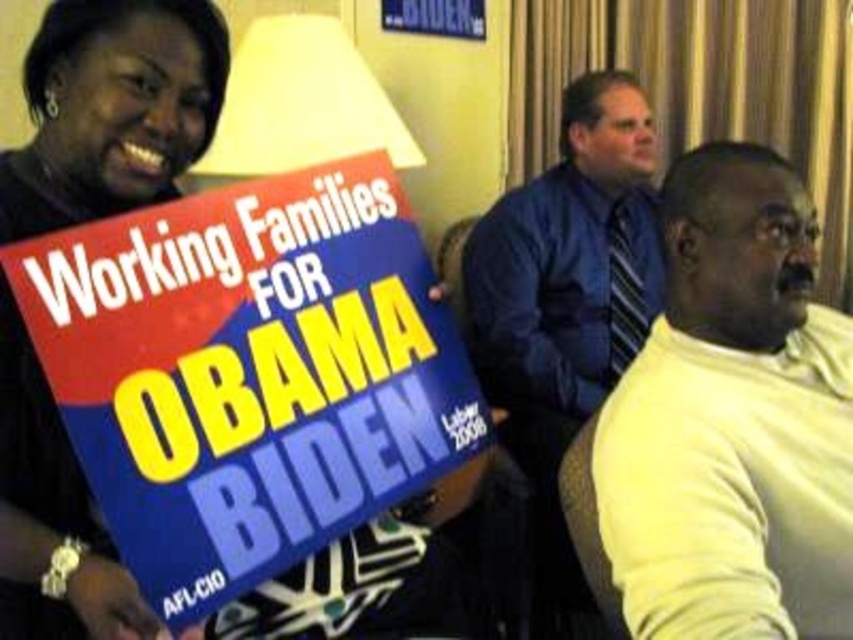
Question: Is yellow sweater at right closer to camera compared to blue fabric shirt at center?

Choices:
 (A) no
 (B) yes

Answer: (B)

Question: Among these points, which one is farthest from the camera?

Choices:
 (A) (161, 19)
 (B) (32, 154)
 (C) (728, 486)

Answer: (B)

Question: Estimate the real-world distances between objects in this image. Which object is farther from the yellow sweater at right?

Choices:
 (A) blue fabric shirt at center
 (B) black matte sign at upper left
 (C) matte black sign at upper left

Answer: (A)

Question: Among these objects, which one is nearest to the camera?

Choices:
 (A) matte black sign at upper left
 (B) black matte sign at upper left
 (C) yellow sweater at right

Answer: (C)

Question: Does black matte sign at upper left have a smaller size compared to matte black sign at upper left?

Choices:
 (A) no
 (B) yes

Answer: (B)

Question: Is black matte sign at upper left above matte black sign at upper left?

Choices:
 (A) yes
 (B) no

Answer: (A)